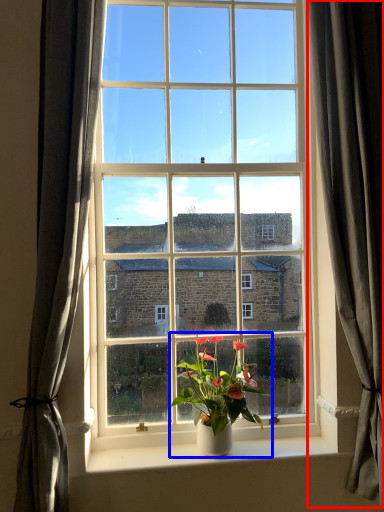
Question: Which point is further to the camera, curtain (highlighted by a red box) or houseplant (highlighted by a blue box)?

Choices:
 (A) curtain
 (B) houseplant

Answer: (B)